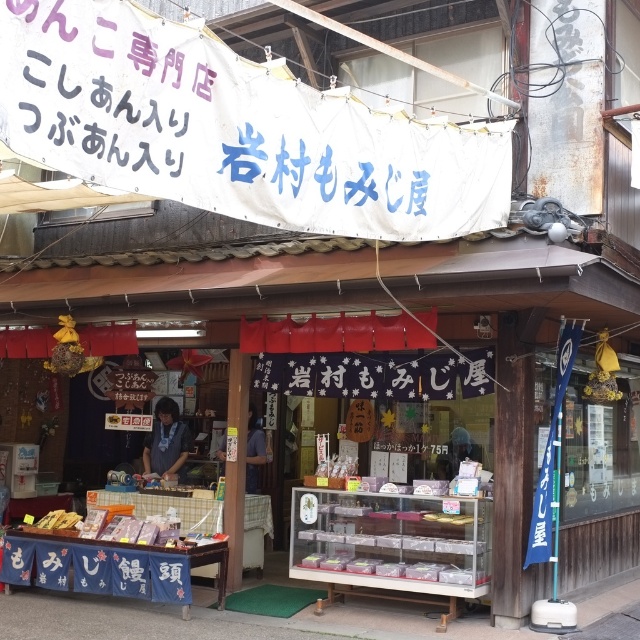
Is white fabric banner at upper center behind matte white box at center?

No, white fabric banner at upper center is closer to the viewer.

You are a GUI agent. You are given a task and a screenshot of the screen. Output one action in this format:
    pyautogui.click(x=<x>, y=<y>)
    Task: Click on the white fabric banner at upper center
    Image resolution: width=640 pixels, height=640 pixels.
    Given the screenshot: What is the action you would take?
    pyautogui.click(x=234, y=129)

Is point (234, 140) in front of point (349, 458)?

Yes, point (234, 140) is closer to viewer.

Locate an element on the screen. white fabric banner at upper center is located at coordinates (234, 129).

Is white fabric banner at upper center shorter than matte plastic box at center?

No.

Which is behind, point (76, 65) or point (432, 520)?

Point (432, 520)

Is point (273, 131) farther from camera compared to point (432, 516)?

No, (273, 131) is closer to viewer.

Identify the location of white fabric banner at upper center. (234, 129).

Is blue fabric apron at center closer to the viewer compared to matte white box at center?

No, blue fabric apron at center is behind matte white box at center.

Who is more forward, (168,432) or (332,474)?

Point (332,474)

Identify the location of blue fabric apron at center. The height and width of the screenshot is (640, 640). (166, 442).

You are a GUI agent. You are given a task and a screenshot of the screen. Output one action in this format:
    pyautogui.click(x=<x>, y=<y>)
    Task: Click on the blue fabric apron at center
    The height and width of the screenshot is (640, 640).
    Given the screenshot: What is the action you would take?
    pyautogui.click(x=166, y=442)